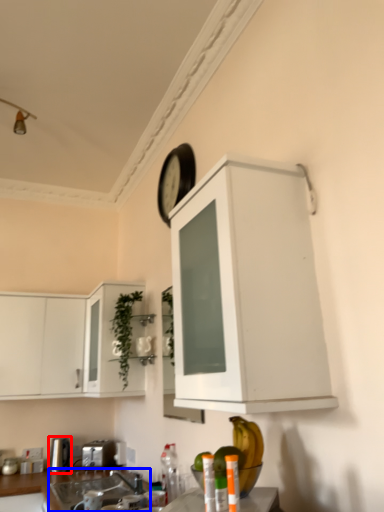
Question: Which object is closer to the camera taking this photo, appliance (highlighted by a red box) or sink (highlighted by a blue box)?

Choices:
 (A) appliance
 (B) sink

Answer: (B)